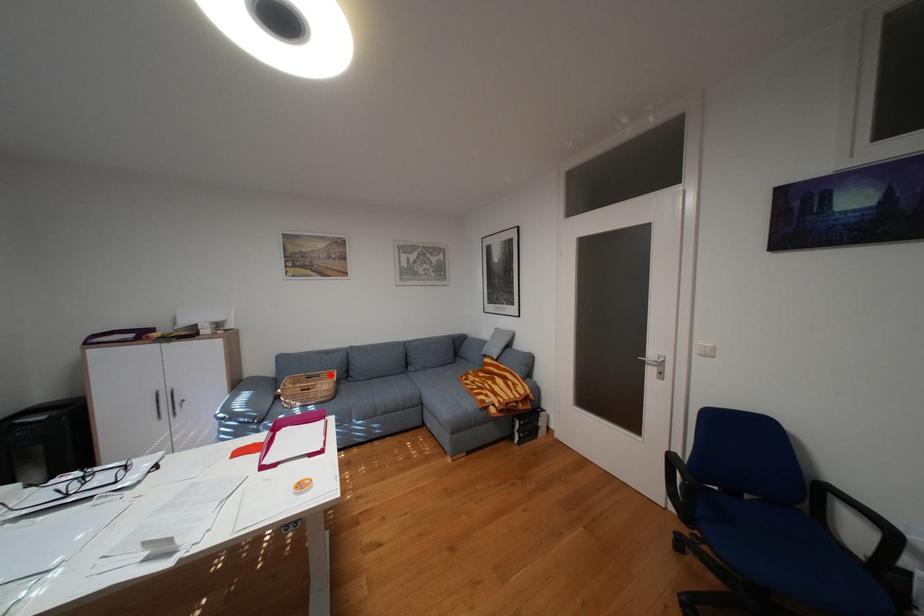
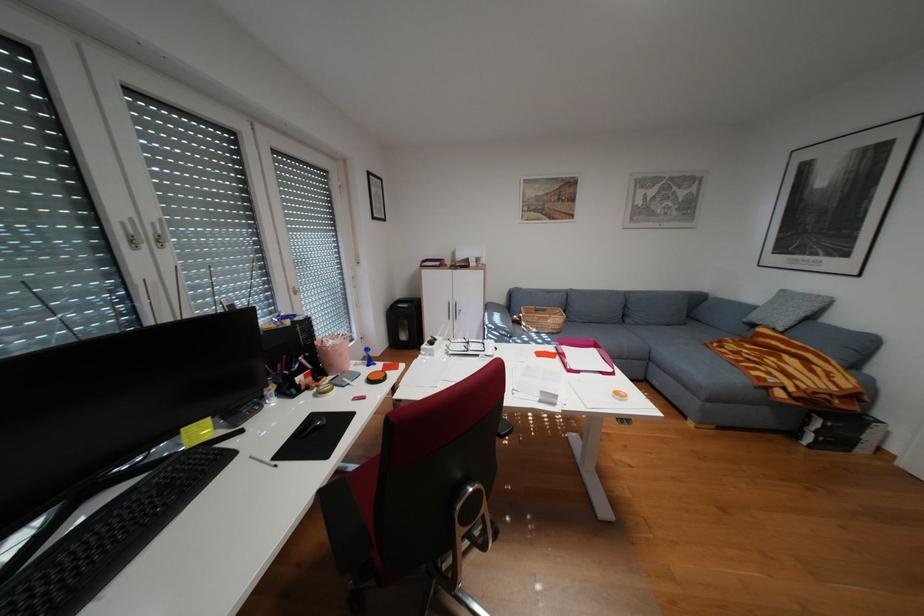
Locate, in the second image, the point that corresponds to the highlighted location in the first image.

(556, 310)